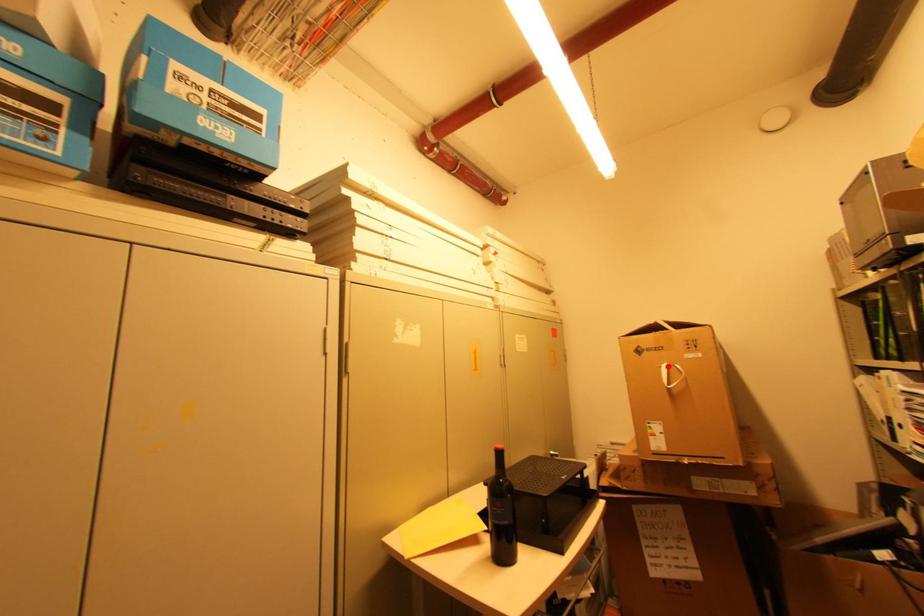
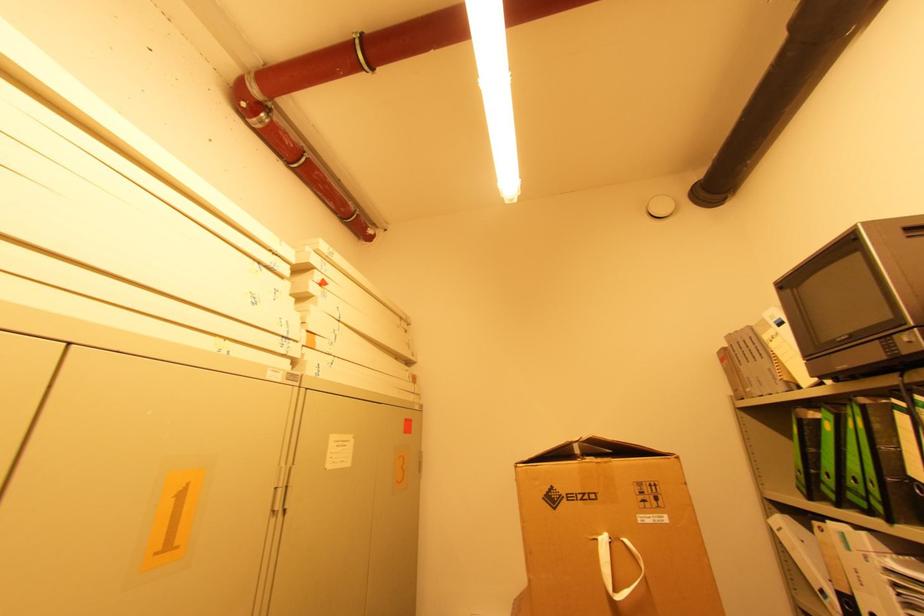
Find the pixel in the second image that matches the highlighted location in the first image.

(608, 541)